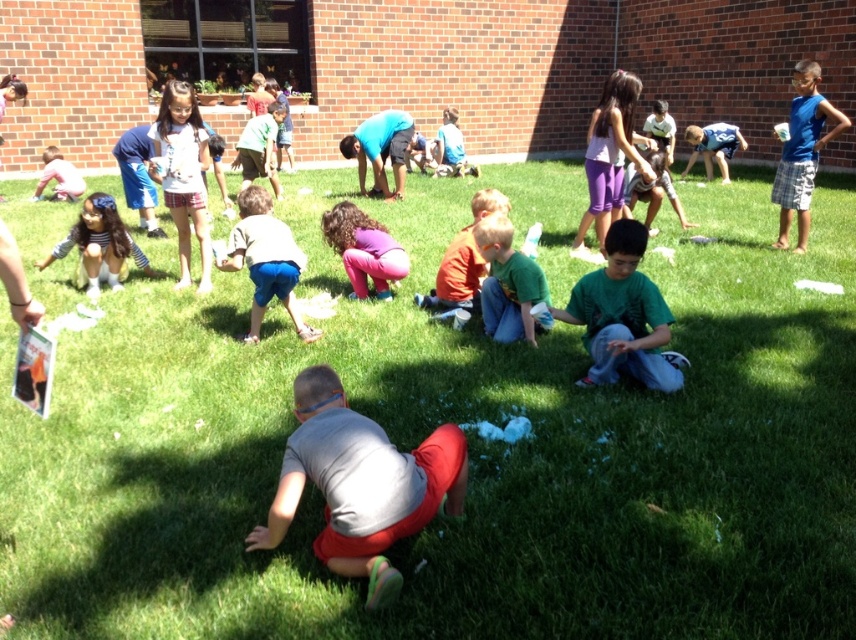
Question: Is light blue denim shorts at center to the right of light pink shirt at lower left from the viewer's perspective?

Choices:
 (A) no
 (B) yes

Answer: (B)

Question: Does blue plaid shorts at right appear under striped fabric dress at lower left?

Choices:
 (A) no
 (B) yes

Answer: (A)

Question: Is pink fabric pants at center bigger than matte blue shirt at center?

Choices:
 (A) no
 (B) yes

Answer: (A)

Question: Which point appears closest to the camera in this image?

Choices:
 (A) (449, 150)
 (B) (64, 196)
 (C) (104, 266)

Answer: (C)

Question: Which of the following is the closest to the observer?

Choices:
 (A) light pink shirt at lower left
 (B) blue plaid shorts at right

Answer: (B)

Question: Which point is farther from the camera taking this photo?

Choices:
 (A) (443, 170)
 (B) (102, 241)
 (C) (284, 298)
 (D) (783, 200)

Answer: (A)